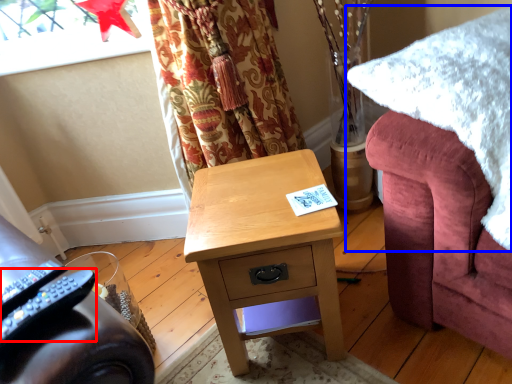
Question: Among these objects, which one is nearest to the camera, remote control (highlighted by a red box) or blanket (highlighted by a blue box)?

Choices:
 (A) remote control
 (B) blanket

Answer: (A)